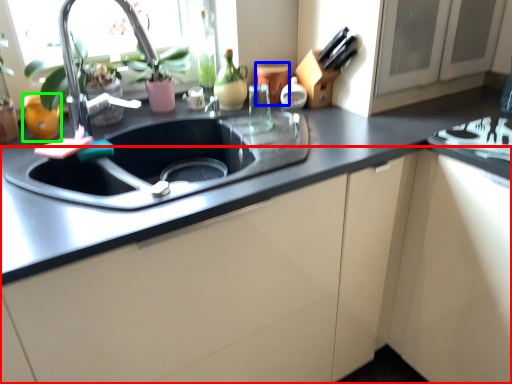
Question: Which object is the farthest from cabinetry (highlighted by a red box)? Choose among these: appliance (highlighted by a blue box) or appliance (highlighted by a green box).

Choices:
 (A) appliance
 (B) appliance

Answer: (B)